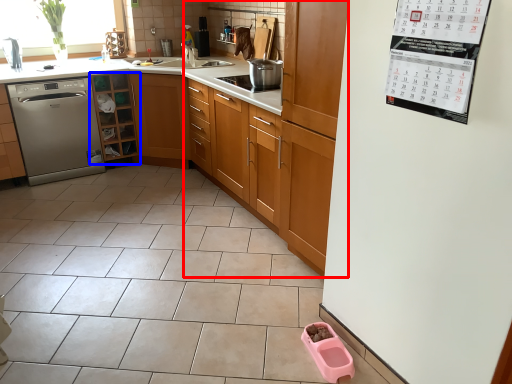
Question: Among these objects, which one is farthest to the camera, cabinetry (highlighted by a red box) or cabinetry (highlighted by a blue box)?

Choices:
 (A) cabinetry
 (B) cabinetry

Answer: (B)